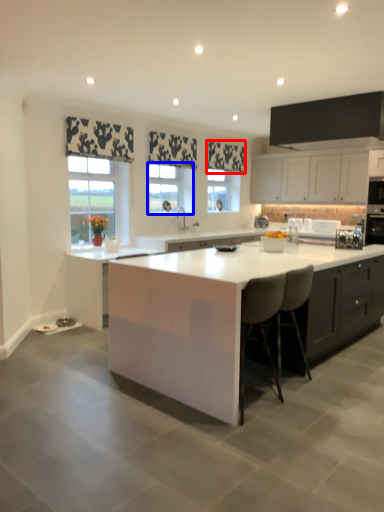
Question: Which object appears closest to the camera in this image, curtain (highlighted by a red box) or window (highlighted by a blue box)?

Choices:
 (A) curtain
 (B) window

Answer: (B)